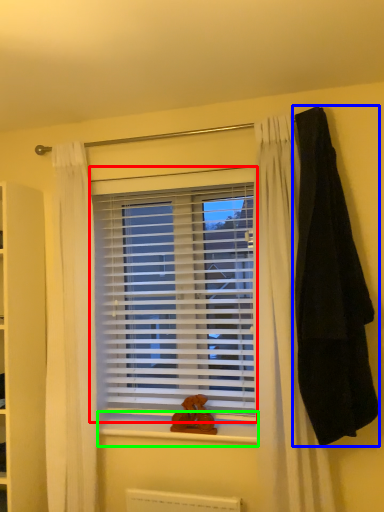
Question: Which object is the farthest from window blind (highlighted by a red box)? Choose among these: blanket (highlighted by a blue box) or window sill (highlighted by a green box).

Choices:
 (A) blanket
 (B) window sill

Answer: (A)